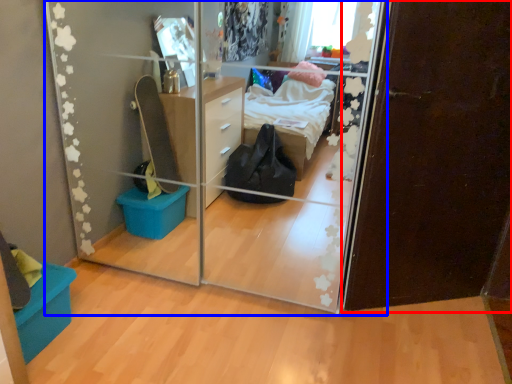
Question: Which point is further to the camera, door (highlighted by a red box) or glass door (highlighted by a blue box)?

Choices:
 (A) door
 (B) glass door

Answer: (A)